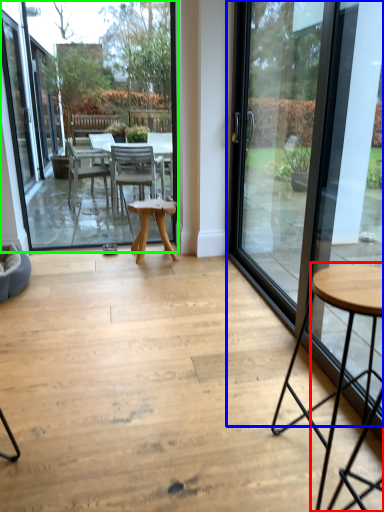
Question: Which is farther away from coffee table (highlighted by a red box)? door (highlighted by a blue box) or window screen (highlighted by a green box)?

Choices:
 (A) door
 (B) window screen

Answer: (B)